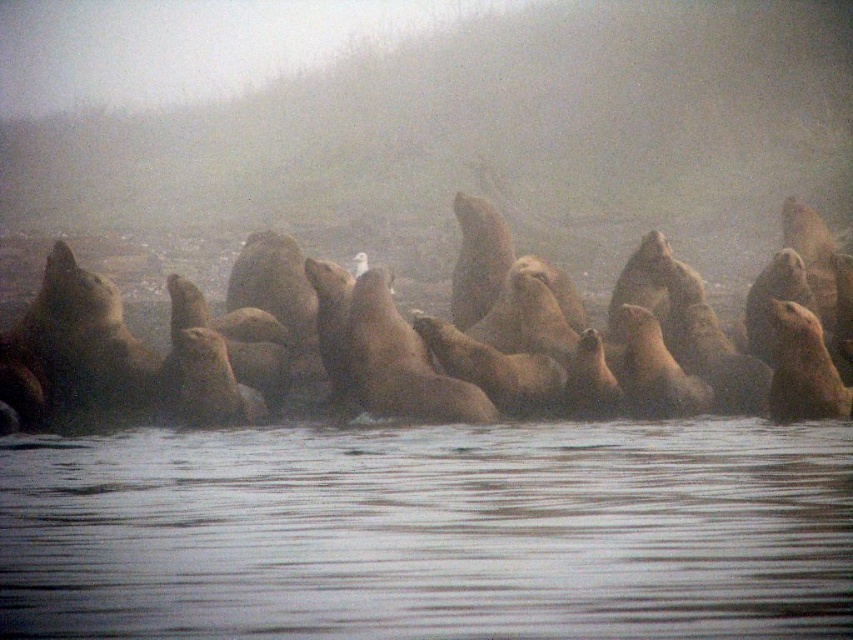
Which is in front, point (502, 620) or point (480, 198)?

Point (502, 620) is in front.

In the scene shown: Is clear water at lower center bigger than light brown fur seal at center?

Yes, clear water at lower center is bigger than light brown fur seal at center.

Which is in front, point (74, 465) or point (456, 330)?

Point (74, 465) is more forward.

Find the location of `clear water at lower center`. clear water at lower center is located at coordinates (430, 532).